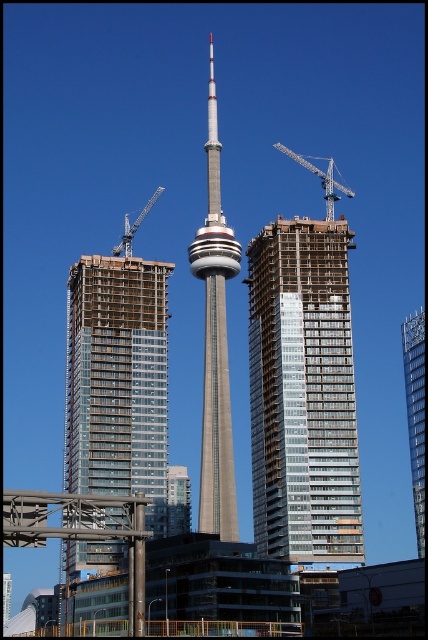
Question: In this image, where is blue metallic crane at upper center located relative to metallic gray crane at left?

Choices:
 (A) right
 (B) left

Answer: (A)

Question: Which object appears closest to the camera in this image?

Choices:
 (A) metallic gray crane at left
 (B) gray concrete tower at center

Answer: (B)

Question: Observing the image, what is the correct spatial positioning of gray concrete tower at center in reference to glassy reflective skyscraper at right?

Choices:
 (A) below
 (B) above

Answer: (B)

Question: Which point appears closest to the camera in this image?

Choices:
 (A) (332, 157)
 (B) (118, 253)
 (C) (335, 285)
 (D) (118, 333)

Answer: (C)

Question: Which of the following is the closest to the observer?

Choices:
 (A) blue metallic crane at upper center
 (B) glass/transparent building at center
 (C) gray concrete tower at center
 (D) glassy reflective skyscraper at right

Answer: (C)

Question: Does blue metallic crane at upper center have a greater width compared to metallic gray crane at left?

Choices:
 (A) yes
 (B) no

Answer: (A)